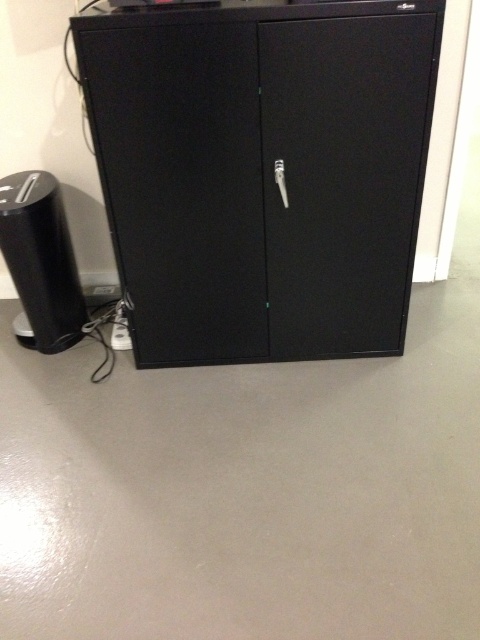
You are standing in an office and see the image. There is a point labeled at coordinates (263, 172). What object is located at that point?

The point at coordinates (263, 172) indicates the matte black cabinet at center.

You are organizing your home office and need to move the black matte speaker at left to another location. Can you lift the matte black cabinet at center to access the speaker underneath?

The matte black cabinet at center is positioned over the black matte speaker at left, so yes, you can lift the matte black cabinet at center to access the speaker underneath.